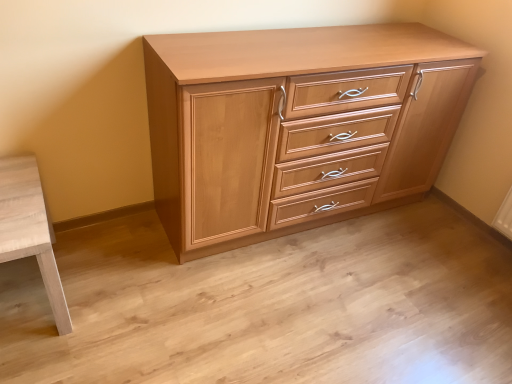
Image resolution: width=512 pixels, height=384 pixels. I want to click on unoccupied space behind light wood table at lower left, so click(x=98, y=241).